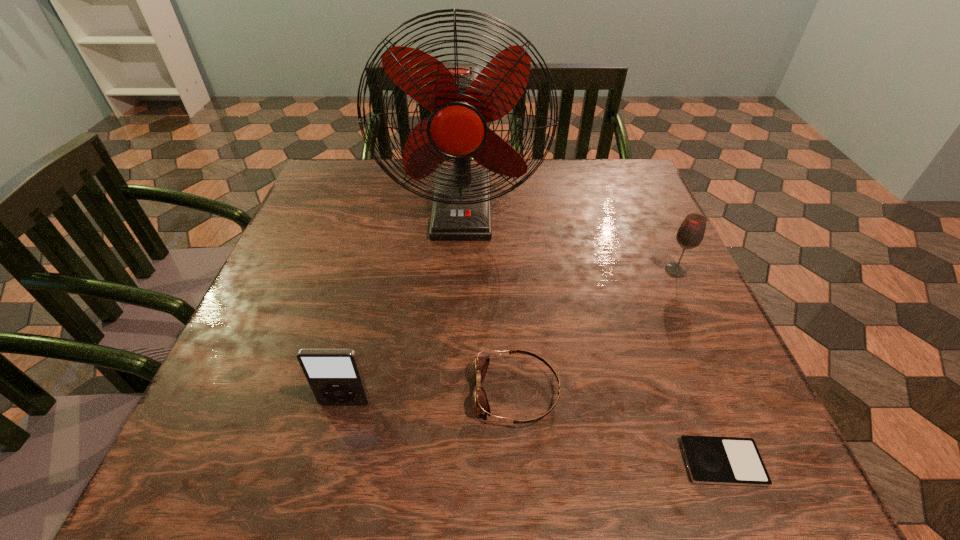
Where is `empty space that is in between the tallest object and the goggles`? The height and width of the screenshot is (540, 960). empty space that is in between the tallest object and the goggles is located at coordinates (490, 301).

Identify the location of free space between the fourth nearest object and the goggles. (596, 331).

Image resolution: width=960 pixels, height=540 pixels. I want to click on free space between the second shortest object and the taller iPod, so click(x=431, y=397).

The image size is (960, 540). In order to click on empty space that is in between the left iPod and the shortest object in this screenshot , I will do `click(534, 433)`.

Identify the location of vacant area that lies between the goggles and the farther iPod. Image resolution: width=960 pixels, height=540 pixels. (431, 397).

Image resolution: width=960 pixels, height=540 pixels. I want to click on empty space between the goggles and the farther iPod, so click(431, 397).

Point out which object is positioned as the nearest to the second farthest object. Please provide its 2D coordinates. Your answer should be formatted as a tuple, i.e. [(x, y)], where the tuple contains the x and y coordinates of a point satisfying the conditions above.

[(462, 99)]

Point out which object is positioned as the nearest to the goggles. Please provide its 2D coordinates. Your answer should be formatted as a tuple, i.e. [(x, y)], where the tuple contains the x and y coordinates of a point satisfying the conditions above.

[(334, 375)]

The width and height of the screenshot is (960, 540). I want to click on free space that satisfies the following two spatial constraints: 1. through the lenses of the right iPod; 2. on the left side of the fourth tallest object, so click(x=521, y=462).

Image resolution: width=960 pixels, height=540 pixels. I want to click on free space that satisfies the following two spatial constraints: 1. on the front-facing side of the taller iPod; 2. on the left side of the shortest object, so click(x=330, y=462).